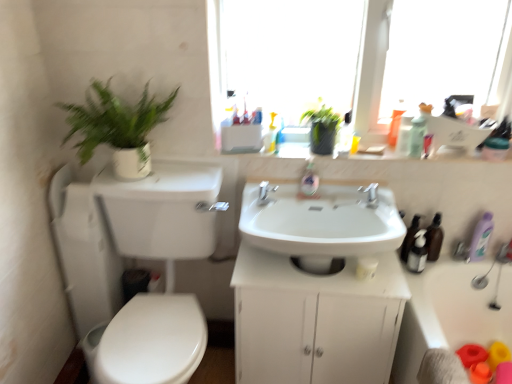
Question: From a real-world perspective, is translucent orange soap dispenser at upper right, which is counted as the second toiletry, starting from the left, on white plastic bathtub at lower right?

Choices:
 (A) no
 (B) yes

Answer: (B)

Question: From the image's perspective, is translucent orange soap dispenser at upper right, the fifth toiletry in the right-to-left sequence, above white plastic bathtub at lower right?

Choices:
 (A) yes
 (B) no

Answer: (A)

Question: Is translucent orange soap dispenser at upper right, the fifth toiletry in the right-to-left sequence, looking in the opposite direction of white plastic bathtub at lower right?

Choices:
 (A) yes
 (B) no

Answer: (B)

Question: Does translucent orange soap dispenser at upper right, which is counted as the second toiletry, starting from the left, turn towards white plastic bathtub at lower right?

Choices:
 (A) yes
 (B) no

Answer: (B)

Question: Is translucent orange soap dispenser at upper right, the fifth toiletry in the right-to-left sequence, far from white plastic bathtub at lower right?

Choices:
 (A) yes
 (B) no

Answer: (B)

Question: In terms of height, does yellow plastic bottle at upper center, which ranks as the 1th toiletry in left-to-right order, look taller or shorter compared to satin black soap dispenser at right, the fourth toiletry from the left?

Choices:
 (A) tall
 (B) short

Answer: (B)

Question: Visually, is yellow plastic bottle at upper center, which ranks as the 1th toiletry in left-to-right order, positioned to the left or to the right of satin black soap dispenser at right, the 3th toiletry positioned from the right?

Choices:
 (A) right
 (B) left

Answer: (B)

Question: Would you say yellow plastic bottle at upper center, which ranks as the 1th toiletry in left-to-right order, is inside or outside satin black soap dispenser at right, the 3th toiletry positioned from the right?

Choices:
 (A) inside
 (B) outside

Answer: (B)

Question: Looking at the image, does yellow plastic bottle at upper center, which ranks as the 1th toiletry in left-to-right order, seem bigger or smaller compared to satin black soap dispenser at right, the 3th toiletry positioned from the right?

Choices:
 (A) big
 (B) small

Answer: (B)

Question: In terms of size, does transparent glass window at upper center appear bigger or smaller than silver metallic faucet at center, positioned as the second tap in left-to-right order?

Choices:
 (A) small
 (B) big

Answer: (B)

Question: From the image's perspective, is transparent glass window at upper center located above or below silver metallic faucet at center, positioned as the second tap in left-to-right order?

Choices:
 (A) below
 (B) above

Answer: (B)

Question: Considering the positions of transparent glass window at upper center and silver metallic faucet at center, the 1th tap from the right, in the image, is transparent glass window at upper center taller or shorter than silver metallic faucet at center, the 1th tap from the right,?

Choices:
 (A) short
 (B) tall

Answer: (B)

Question: Looking at their shapes, would you say transparent glass window at upper center is wider or thinner than silver metallic faucet at center, positioned as the second tap in left-to-right order?

Choices:
 (A) wide
 (B) thin

Answer: (A)

Question: From a real-world perspective, is translucent orange soap dispenser at upper right, the fifth toiletry in the right-to-left sequence, positioned above or below white plastic bathtub at lower right?

Choices:
 (A) above
 (B) below

Answer: (A)

Question: Is translucent orange soap dispenser at upper right, the fifth toiletry in the right-to-left sequence, in front of or behind white plastic bathtub at lower right in the image?

Choices:
 (A) behind
 (B) front

Answer: (A)